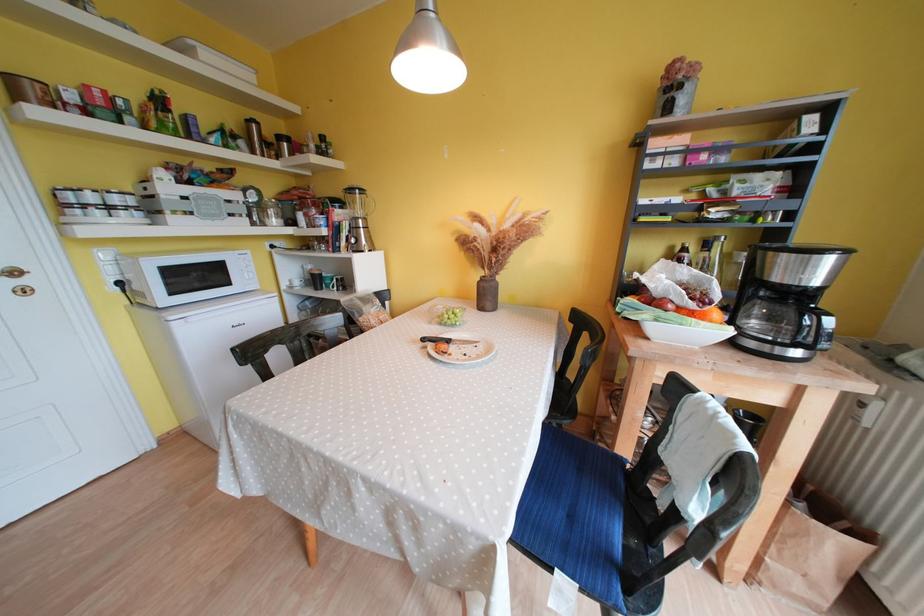
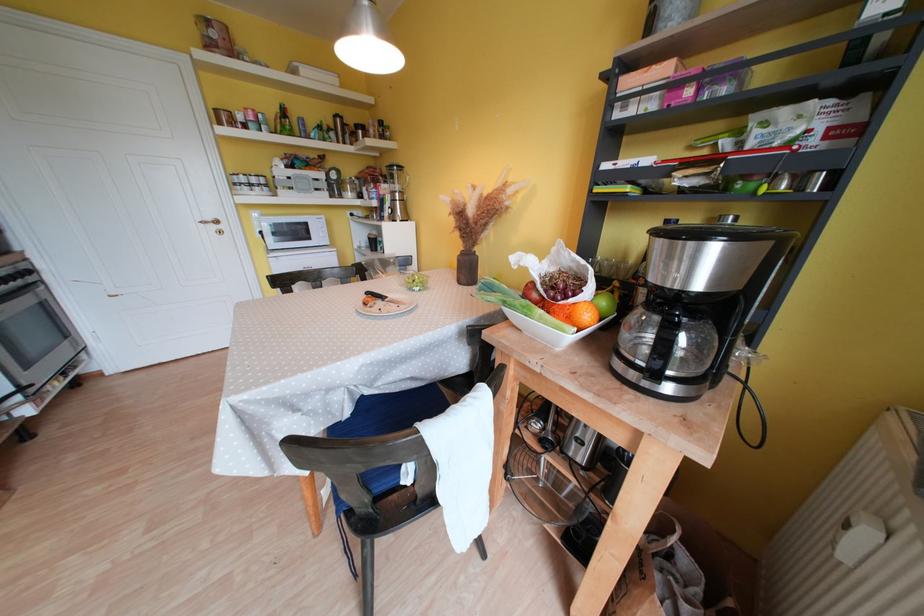
The point at (x=430, y=342) is marked in the first image. Where is the corresponding point in the second image?

(373, 297)